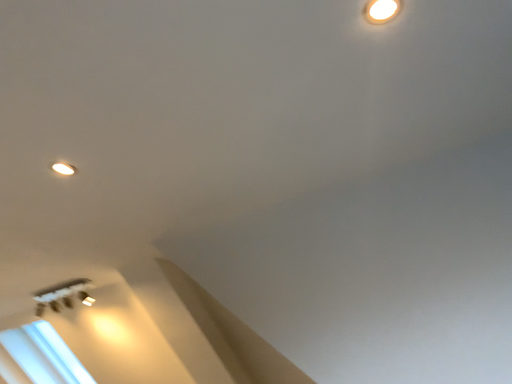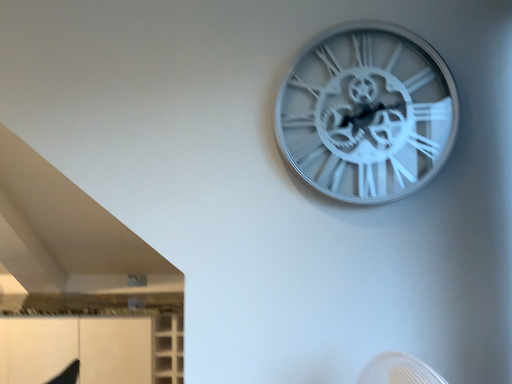
Question: How did the camera likely rotate when shooting the video?

Choices:
 (A) rotated left
 (B) rotated right

Answer: (B)